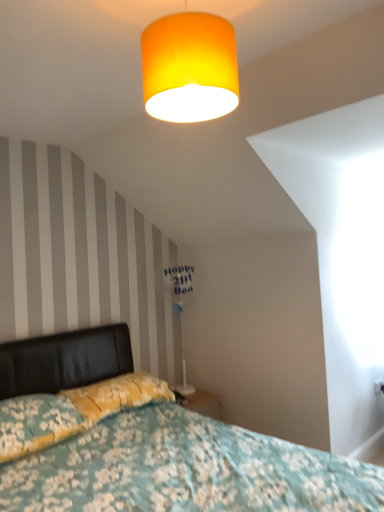
Question: Is floral fabric pillow at lower left, the 2th pillow when ordered from back to front, further to the viewer compared to white plastic table lamp at center?

Choices:
 (A) yes
 (B) no

Answer: (B)

Question: Does floral fabric pillow at lower left, which is the first pillow in front-to-back order, have a greater width compared to white plastic table lamp at center?

Choices:
 (A) yes
 (B) no

Answer: (A)

Question: Is floral fabric pillow at lower left, which is the first pillow in front-to-back order, looking in the opposite direction of white plastic table lamp at center?

Choices:
 (A) yes
 (B) no

Answer: (B)

Question: Can you confirm if floral fabric pillow at lower left, the 2th pillow when ordered from back to front, is positioned to the right of white plastic table lamp at center?

Choices:
 (A) yes
 (B) no

Answer: (B)

Question: From a real-world perspective, is floral fabric pillow at lower left, which is the first pillow in front-to-back order, physically above white plastic table lamp at center?

Choices:
 (A) no
 (B) yes

Answer: (A)

Question: Does floral fabric bed at lower left have a greater height compared to floral fabric pillow at lower left, which is the first pillow in front-to-back order?

Choices:
 (A) yes
 (B) no

Answer: (A)

Question: Is floral fabric bed at lower left in front of floral fabric pillow at lower left, the 2th pillow when ordered from back to front?

Choices:
 (A) no
 (B) yes

Answer: (B)

Question: Considering the relative sizes of floral fabric bed at lower left and floral fabric pillow at lower left, the 2th pillow when ordered from back to front, in the image provided, is floral fabric bed at lower left bigger than floral fabric pillow at lower left, the 2th pillow when ordered from back to front,?

Choices:
 (A) yes
 (B) no

Answer: (A)

Question: Can you confirm if floral fabric bed at lower left is wider than floral fabric pillow at lower left, which is the first pillow in front-to-back order?

Choices:
 (A) yes
 (B) no

Answer: (A)

Question: Is floral fabric pillow at lower left, which is the first pillow in front-to-back order, inside floral fabric bed at lower left?

Choices:
 (A) yes
 (B) no

Answer: (A)

Question: Does floral fabric bed at lower left turn towards floral fabric pillow at lower left, the 2th pillow when ordered from back to front?

Choices:
 (A) no
 (B) yes

Answer: (A)

Question: Is the surface of yellow floral fabric pillow at lower left, which appears as the first pillow when viewed from the back, in direct contact with floral fabric pillow at lower left, which is the first pillow in front-to-back order?

Choices:
 (A) yes
 (B) no

Answer: (B)